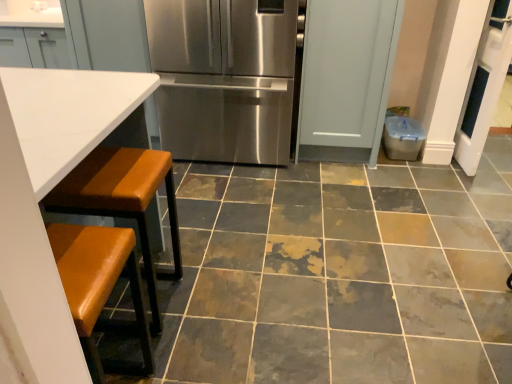
Question: Should I look upward or downward to see marble-like ceramic tile at center?

Choices:
 (A) up
 (B) down

Answer: (B)

Question: Does white leather table at left turn towards stainless steel refrigerator at center?

Choices:
 (A) yes
 (B) no

Answer: (A)

Question: Considering the relative sizes of white leather table at left and stainless steel refrigerator at center in the image provided, is white leather table at left taller than stainless steel refrigerator at center?

Choices:
 (A) no
 (B) yes

Answer: (A)

Question: Does white leather table at left have a greater width compared to stainless steel refrigerator at center?

Choices:
 (A) yes
 (B) no

Answer: (A)

Question: Is the depth of white leather table at left less than that of stainless steel refrigerator at center?

Choices:
 (A) no
 (B) yes

Answer: (B)

Question: Is white leather table at left smaller than stainless steel refrigerator at center?

Choices:
 (A) no
 (B) yes

Answer: (B)

Question: Considering the relative sizes of white leather table at left and stainless steel refrigerator at center in the image provided, is white leather table at left bigger than stainless steel refrigerator at center?

Choices:
 (A) yes
 (B) no

Answer: (B)

Question: Can you confirm if white leather table at left is bigger than marble-like ceramic tile at center?

Choices:
 (A) yes
 (B) no

Answer: (A)

Question: Does white leather table at left come in front of marble-like ceramic tile at center?

Choices:
 (A) no
 (B) yes

Answer: (B)

Question: Is white leather table at left aimed at marble-like ceramic tile at center?

Choices:
 (A) yes
 (B) no

Answer: (B)

Question: Is white leather table at left oriented away from marble-like ceramic tile at center?

Choices:
 (A) no
 (B) yes

Answer: (A)

Question: Considering the relative sizes of white leather table at left and marble-like ceramic tile at center in the image provided, is white leather table at left smaller than marble-like ceramic tile at center?

Choices:
 (A) no
 (B) yes

Answer: (A)

Question: From a real-world perspective, is white leather table at left located beneath marble-like ceramic tile at center?

Choices:
 (A) no
 (B) yes

Answer: (A)

Question: Is brown leather stool at lower left bigger than white leather table at left?

Choices:
 (A) no
 (B) yes

Answer: (A)